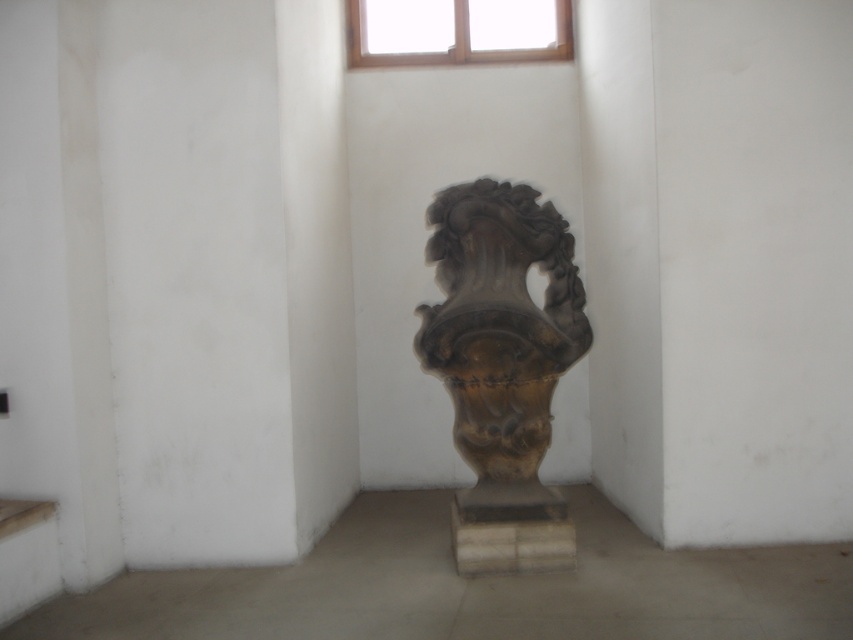
Which is in front, point (480, 348) or point (491, 58)?

Point (480, 348)

In the scene shown: Is brown stone vase at center positioned before wooden frame at upper center?

Yes, brown stone vase at center is closer to the viewer.

Does point (486, 349) come closer to viewer compared to point (408, 26)?

Yes, point (486, 349) is in front of point (408, 26).

Identify the location of brown stone vase at center. (502, 365).